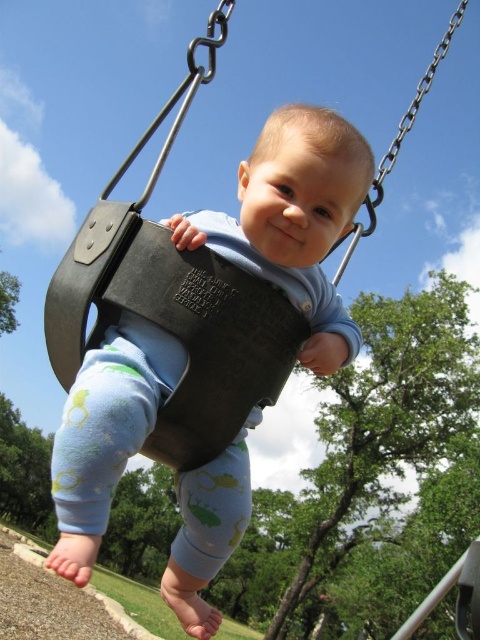
Is point (110, 486) less distant than point (205, 348)?

That is True.

Who is more distant from viewer, (297, 282) or (103, 314)?

The point (297, 282) is more distant.

What do you see at coordinates (295, 220) in the screenshot?
I see `matte black swing at center` at bounding box center [295, 220].

Identify the location of matte black swing at center. The image size is (480, 640). (295, 220).